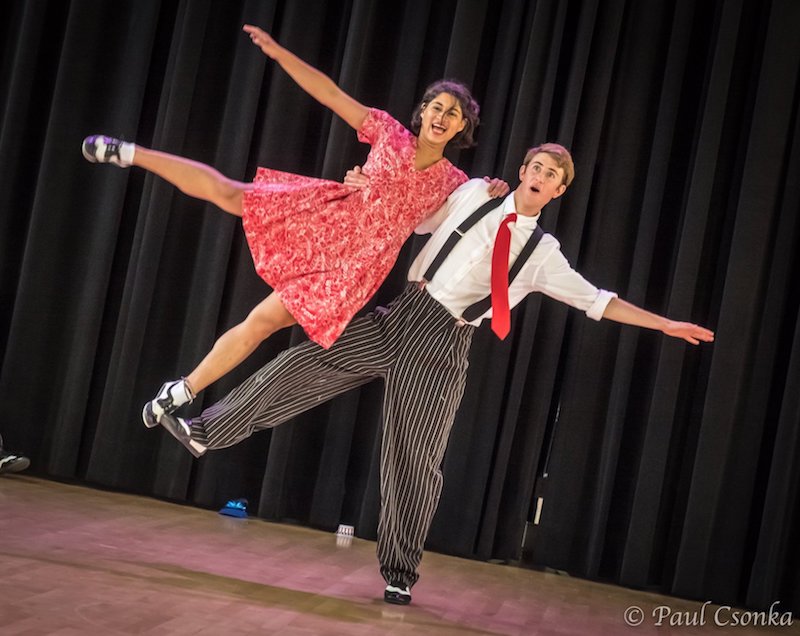
What are the coordinates of `shoe` in the screenshot? It's located at (109, 160), (174, 402), (190, 425), (402, 591).